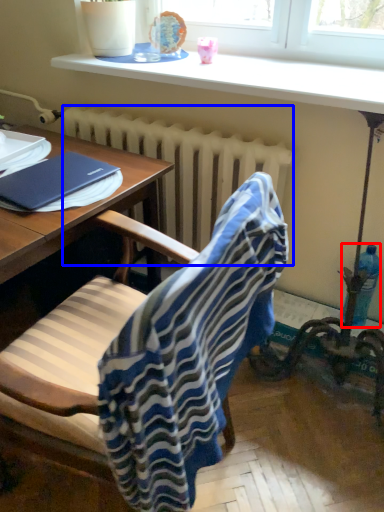
Question: Which point is closer to the camera, bottle (highlighted by a red box) or radiator (highlighted by a blue box)?

Choices:
 (A) bottle
 (B) radiator

Answer: (B)